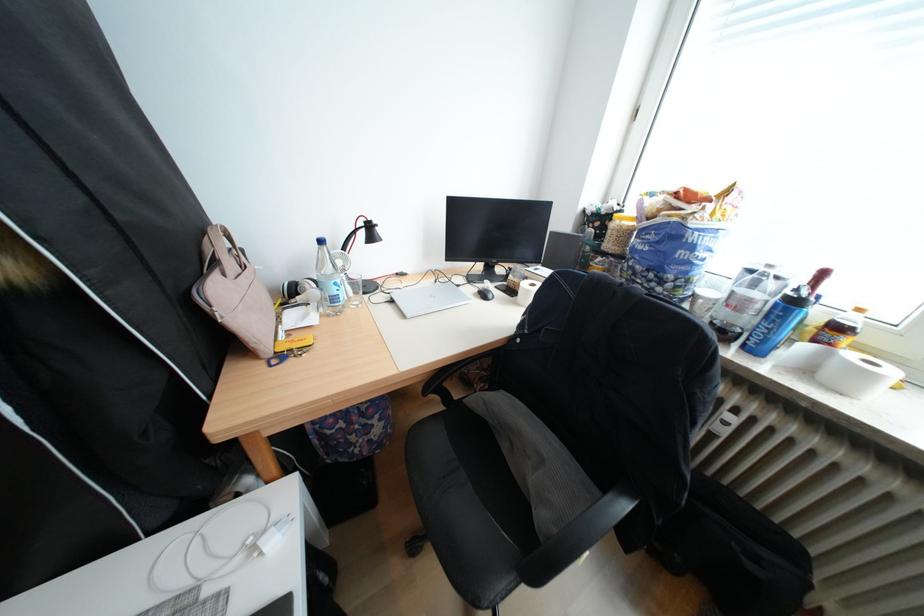
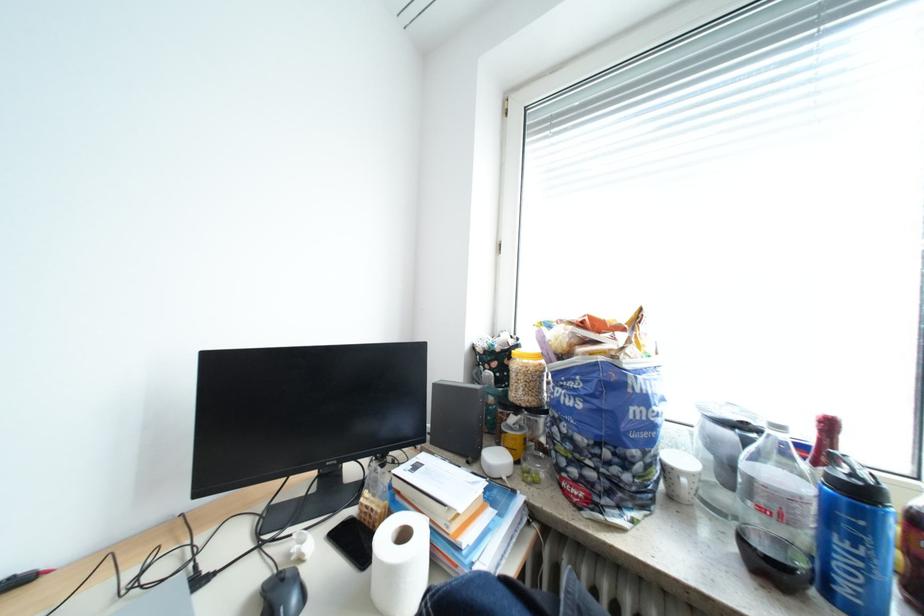
Find the pixel in the second image that matches point (724, 323) in the first image.

(756, 541)